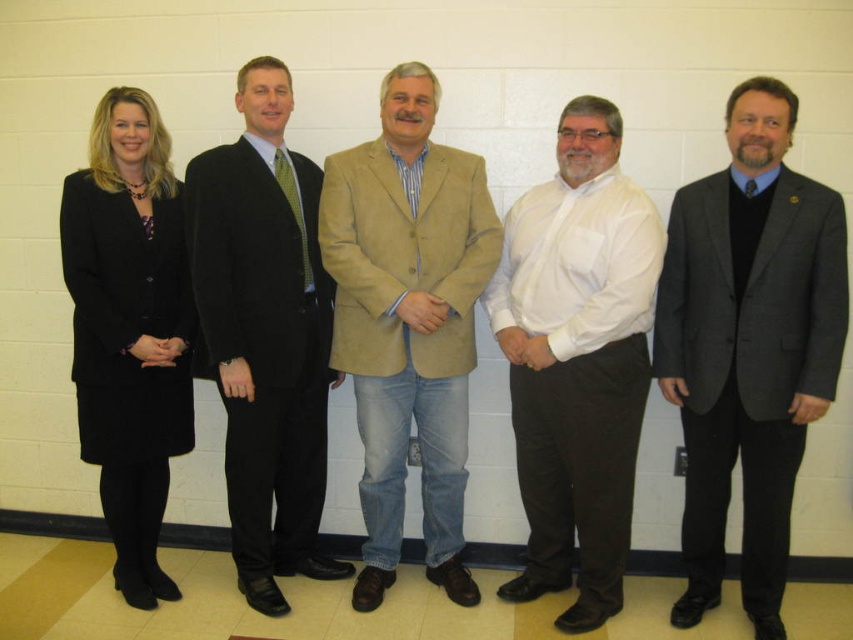
From the picture: You are a photographer setting up for a group photo. You notice the white shirt at center and the tan suede blazer at center. Which one should you focus on first if you want to ensure both are in sharp focus?

The white shirt at center is located below the tan suede blazer at center. To ensure both are in sharp focus, you should focus on the tan suede blazer at center first because it is higher up, allowing the depth of field to naturally cover the lower positioned white shirt at center.

You are a photographer setting up for a group photo. You notice the white shirt at center and the matte black suit at center. Which one is positioned lower in the image?

The white shirt at center is located below the matte black suit at center, so the white shirt at center is positioned lower in the image.

You are standing in front of the group of five people. You want to know which of the two points, point [381,333] or point [67,188], is closer to you. Which one is closer?

Point [381,333] is further to the camera than point [67,188], so point [67,188] is closer to you.